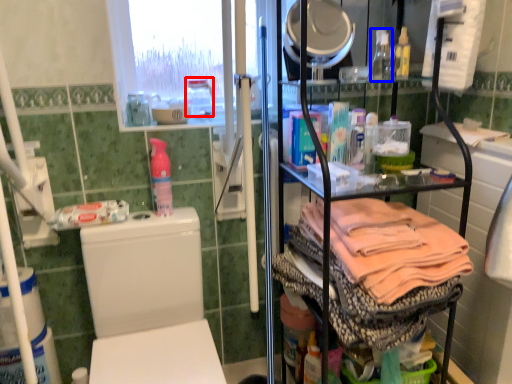
Question: Among these objects, which one is nearest to the camera, bottle (highlighted by a red box) or bottle (highlighted by a blue box)?

Choices:
 (A) bottle
 (B) bottle

Answer: (B)